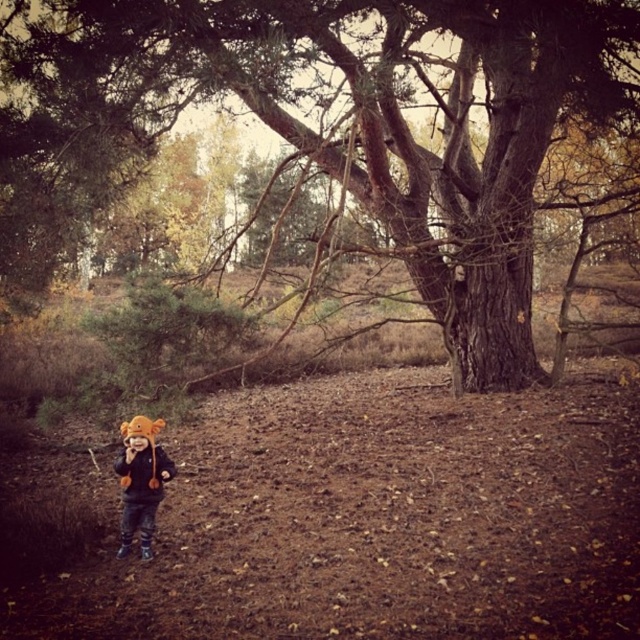
Question: Does brown rough bark tree at center have a larger size compared to brown fuzzy hat at lower left?

Choices:
 (A) no
 (B) yes

Answer: (B)

Question: Where is brown rough bark tree at center located in relation to brown fuzzy hat at lower left in the image?

Choices:
 (A) above
 (B) below

Answer: (A)

Question: Estimate the real-world distances between objects in this image. Which object is closer to the orange fuzzy jacket at lower left?

Choices:
 (A) brown fuzzy hat at lower left
 (B) brown rough bark tree at center

Answer: (A)

Question: Which object is farther from the camera taking this photo?

Choices:
 (A) orange fuzzy jacket at lower left
 (B) brown rough bark tree at center
 (C) brown fuzzy hat at lower left

Answer: (A)

Question: Which point is closer to the camera?

Choices:
 (A) (141, 532)
 (B) (157, 481)

Answer: (A)

Question: Is brown fuzzy hat at lower left closer to camera compared to orange fuzzy jacket at lower left?

Choices:
 (A) no
 (B) yes

Answer: (B)